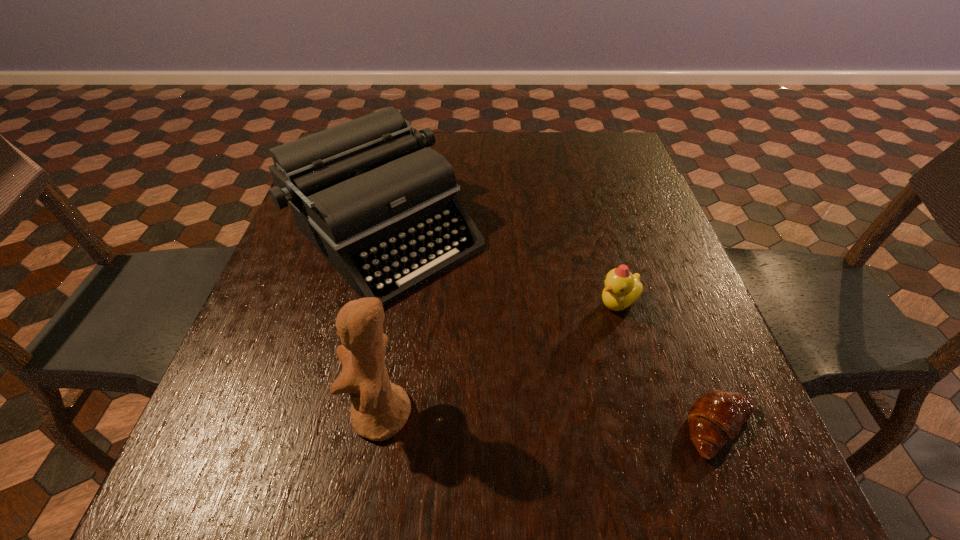
Locate an element on the screen. The width and height of the screenshot is (960, 540). free space between the third shortest object and the second shortest object is located at coordinates [503, 269].

Identify the location of empty location between the second object from right to left and the typewriter. coord(503,269).

Identify the location of free space between the second tallest object and the tallest object. This screenshot has width=960, height=540. (385, 325).

You are a GUI agent. You are given a task and a screenshot of the screen. Output one action in this format:
    pyautogui.click(x=<x>, y=<y>)
    Task: Click on the vacant area that lies between the shortest object and the second object from right to left
    
    Given the screenshot: What is the action you would take?
    click(669, 366)

The image size is (960, 540). What are the coordinates of `vacant space that is in between the typewriter and the duckling` in the screenshot? It's located at (503, 269).

The height and width of the screenshot is (540, 960). I want to click on free space between the figurine and the second tallest object, so click(385, 325).

Locate an element on the screen. This screenshot has height=540, width=960. unoccupied area between the shortest object and the tallest object is located at coordinates (551, 422).

Identify which object is the third closest to the tallest object. Please provide its 2D coordinates. Your answer should be formatted as a tuple, i.e. [(x, y)], where the tuple contains the x and y coordinates of a point satisfying the conditions above.

[(716, 417)]

Identify the location of object that ranks as the third closest to the typewriter. (716, 417).

This screenshot has height=540, width=960. Identify the location of free space that satisfies the following two spatial constraints: 1. on the front side of the tallest object; 2. on the front-facing side of the second tallest object. (348, 415).